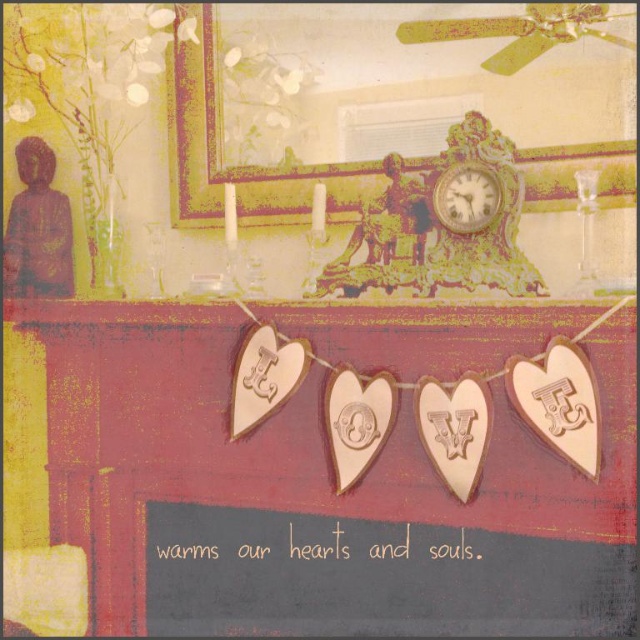
Question: Can you confirm if metallic gold picture frame at upper center is positioned above gold textured clock at upper center?

Choices:
 (A) yes
 (B) no

Answer: (A)

Question: Which of the following is the closest to the observer?

Choices:
 (A) (483, 220)
 (B) (602, 141)

Answer: (A)

Question: Which point is farther from the camera taking this photo?

Choices:
 (A) (467, 196)
 (B) (276, 344)

Answer: (B)

Question: Which point is closer to the camera?

Choices:
 (A) (436, 145)
 (B) (444, 198)

Answer: (B)

Question: Is wooden hearts at center positioned behind metallic gold picture frame at upper center?

Choices:
 (A) no
 (B) yes

Answer: (A)

Question: Can you confirm if metallic gold picture frame at upper center is smaller than gold textured clock at upper center?

Choices:
 (A) no
 (B) yes

Answer: (A)